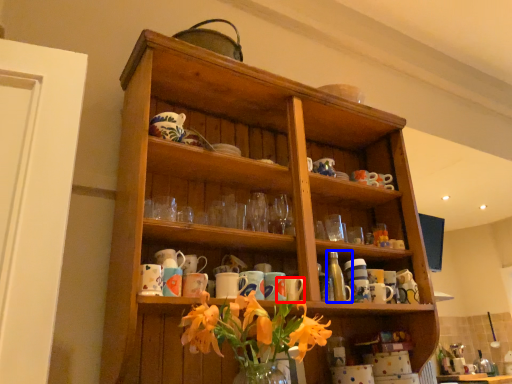
Question: Which object appears closest to the camera in this image, mug (highlighted by a red box) or bottle (highlighted by a blue box)?

Choices:
 (A) mug
 (B) bottle

Answer: (A)